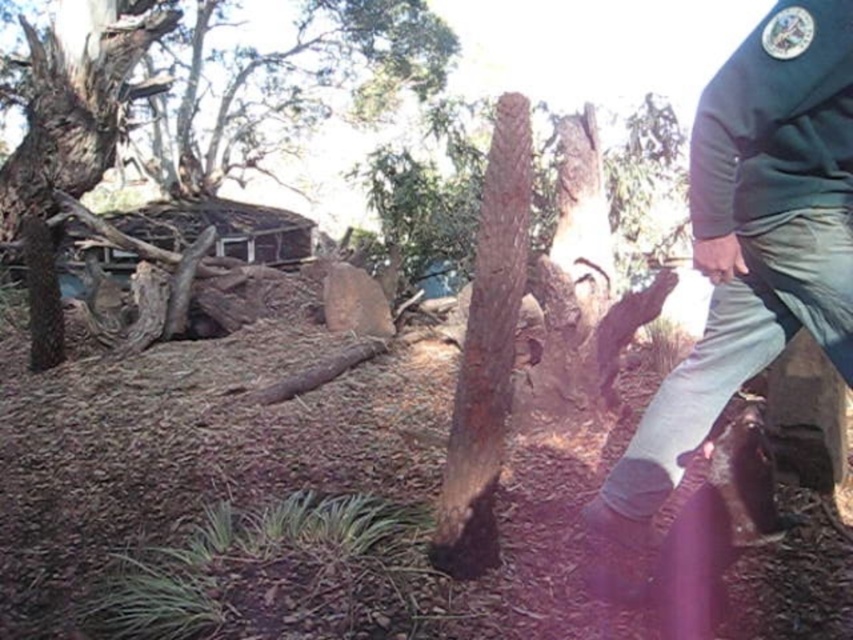
Question: Which of the following is the closest to the observer?

Choices:
 (A) dark brown rough bark tree at left
 (B) brown rough bark tree trunk at center

Answer: (B)

Question: Does dark brown rough bark tree at left have a smaller size compared to brown rough bark tree trunk at center?

Choices:
 (A) yes
 (B) no

Answer: (B)

Question: Does dark green uniform at center have a lesser width compared to dark brown rough bark tree at left?

Choices:
 (A) yes
 (B) no

Answer: (A)

Question: Based on their relative distances, which object is farther from the dark brown rough bark tree at left?

Choices:
 (A) dark green uniform at center
 (B) brown rough bark tree trunk at center

Answer: (A)

Question: Based on their relative distances, which object is farther from the dark brown rough bark tree at left?

Choices:
 (A) brown rough bark tree trunk at center
 (B) dark green uniform at center

Answer: (B)

Question: Can you confirm if dark green uniform at center is positioned to the right of dark brown rough bark tree at left?

Choices:
 (A) yes
 (B) no

Answer: (A)